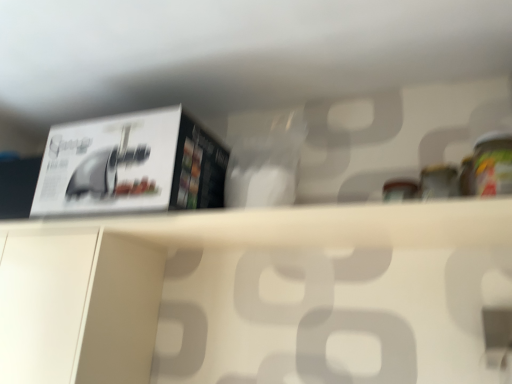
What do you see at coordinates (130, 166) in the screenshot?
I see `white matte paper at upper left` at bounding box center [130, 166].

Find the location of a particular element. The height and width of the screenshot is (384, 512). white matte paper at upper left is located at coordinates (130, 166).

The width and height of the screenshot is (512, 384). I want to click on white matte shelf at center, so click(314, 225).

Based on the photo, what is the approximate width of white matte shelf at center?

white matte shelf at center is 9.45 inches in width.

Describe the element at coordinates (314, 225) in the screenshot. I see `white matte shelf at center` at that location.

Where is `white matte paper at upper left`? This screenshot has width=512, height=384. white matte paper at upper left is located at coordinates (130, 166).

Between white matte shelf at center and white matte paper at upper left, which one appears on the left side from the viewer's perspective?

Positioned to the left is white matte paper at upper left.

Based on the photo, does white matte shelf at center lie in front of white matte paper at upper left?

Yes, it is in front of white matte paper at upper left.

Considering the positions of points (170, 226) and (91, 206), is point (170, 226) farther from camera compared to point (91, 206)?

No, (170, 226) is in front of (91, 206).

From the image's perspective, is white matte shelf at center below white matte paper at upper left?

Yes, from the image's perspective, white matte shelf at center is below white matte paper at upper left.

From a real-world perspective, who is located lower, white matte shelf at center or white matte paper at upper left?

white matte shelf at center is physically lower.

Is white matte shelf at center thinner than white matte paper at upper left?

Correct, the width of white matte shelf at center is less than that of white matte paper at upper left.

Does white matte shelf at center have a lesser height compared to white matte paper at upper left?

Indeed, white matte shelf at center has a lesser height compared to white matte paper at upper left.

Considering the relative sizes of white matte shelf at center and white matte paper at upper left in the image provided, is white matte shelf at center smaller than white matte paper at upper left?

Yes, white matte shelf at center is smaller than white matte paper at upper left.

Is white matte paper at upper left a part of white matte shelf at center?

That's incorrect, white matte paper at upper left is not inside white matte shelf at center.

Is there a large distance between white matte shelf at center and white matte paper at upper left?

white matte shelf at center is near white matte paper at upper left, not far away.

Is white matte shelf at center oriented away from white matte paper at upper left?

white matte shelf at center does not have its back to white matte paper at upper left.

I want to click on paperback book on the left of white matte shelf at center, so click(130, 166).

Considering the positions of objects white matte paper at upper left and white matte shelf at center in the image provided, who is more to the left, white matte paper at upper left or white matte shelf at center?

white matte paper at upper left.

Does white matte paper at upper left lie behind white matte shelf at center?

Yes.

Is point (58, 168) closer to camera compared to point (384, 209)?

No, it is not.

From the image's perspective, which one is positioned higher, white matte paper at upper left or white matte shelf at center?

white matte paper at upper left appears higher in the image.

From a real-world perspective, who is located higher, white matte paper at upper left or white matte shelf at center?

From a 3D spatial view, white matte paper at upper left is above.

Between white matte paper at upper left and white matte shelf at center, which one has smaller width?

With smaller width is white matte shelf at center.

Who is taller, white matte paper at upper left or white matte shelf at center?

Standing taller between the two is white matte paper at upper left.

Which of these two, white matte paper at upper left or white matte shelf at center, is smaller?

white matte shelf at center is smaller.

Is white matte paper at upper left located outside white matte shelf at center?

white matte paper at upper left lies outside white matte shelf at center's area.

Looking at this image, is there a large distance between white matte paper at upper left and white matte shelf at center?

No, white matte paper at upper left is not far away from white matte shelf at center.

Is white matte shelf at center at the back of white matte paper at upper left?

No.

In the image, there is a white matte paper at upper left. Where is `shelf below it (from the image's perspective)`? The image size is (512, 384). shelf below it (from the image's perspective) is located at coordinates (314, 225).

The height and width of the screenshot is (384, 512). Identify the location of paperback book on the left side of white matte shelf at center. (130, 166).

Where is `shelf on the right of white matte paper at upper left`? The height and width of the screenshot is (384, 512). shelf on the right of white matte paper at upper left is located at coordinates (314, 225).